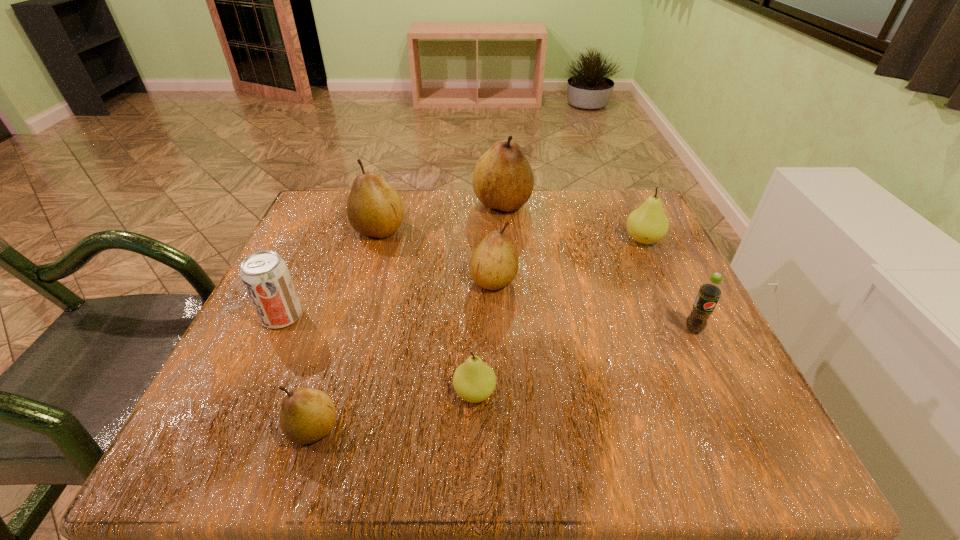
This screenshot has height=540, width=960. I want to click on the tallest pear, so click(x=503, y=179).

This screenshot has height=540, width=960. Identify the location of the tallest object. (503, 179).

Where is `the second tallest object`? Image resolution: width=960 pixels, height=540 pixels. the second tallest object is located at coordinates (374, 209).

The image size is (960, 540). Identify the location of the second tallest pear. (374, 209).

At what (x,y) coordinates should I click in order to perform the action: click on the right green pear. Please return your answer as a coordinate pair (x, y). Looking at the image, I should click on (648, 224).

Locate an element on the screen. The image size is (960, 540). the rightmost pear is located at coordinates (648, 224).

Locate an element on the screen. The width and height of the screenshot is (960, 540). the fifth nearest object is located at coordinates (494, 263).

You are a GUI agent. You are given a task and a screenshot of the screen. Output one action in this format:
    pyautogui.click(x=<x>, y=<y>)
    Task: Click on the third farthest brown pear
    
    Given the screenshot: What is the action you would take?
    pyautogui.click(x=494, y=263)

Locate an element on the screen. the leftmost object is located at coordinates (265, 275).

Locate an element on the screen. the right soda is located at coordinates (709, 293).